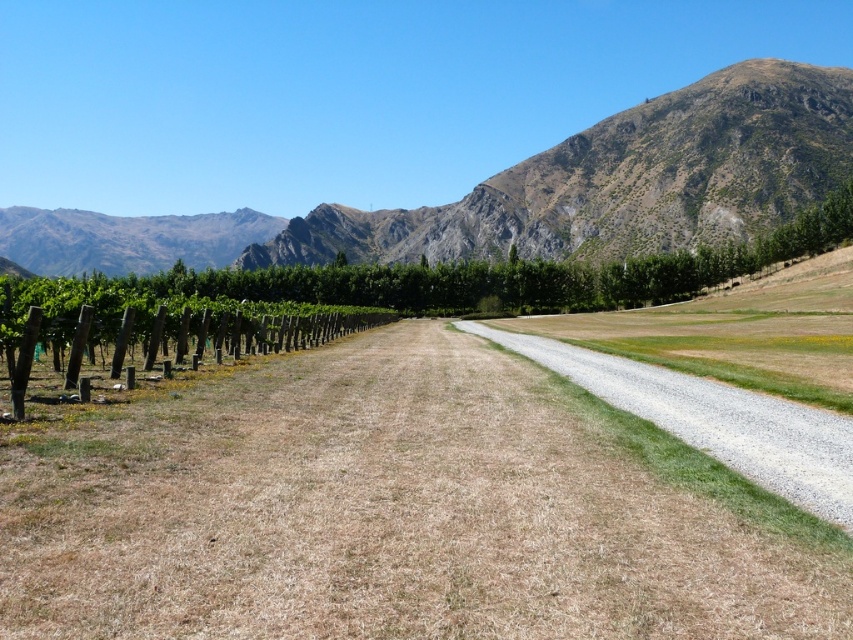
You are standing at the point labeled point (527,192) in the image. What geographical feature do you see in that location?

The point (527,192) corresponds to rugged brown mountain at upper center.

You are a hiker standing at the base of the rugged brown mountain at upper center and want to reach the brown grassy dirt track at center. Which direction should you move relative to the mountain?

You should move to the right of rugged brown mountain at upper center to reach the brown grassy dirt track at center, as the track is positioned to the right of the mountain.

You are a hiker planning to traverse the landscape shown in the image. You need to decide whether to take the brown grassy dirt track at center or the rugged brown mountain at upper center for your hike. Based on their heights, which path would be easier to climb?

The brown grassy dirt track at center has a lesser height compared to the rugged brown mountain at upper center, so it would be easier to climb the brown grassy dirt track at center.